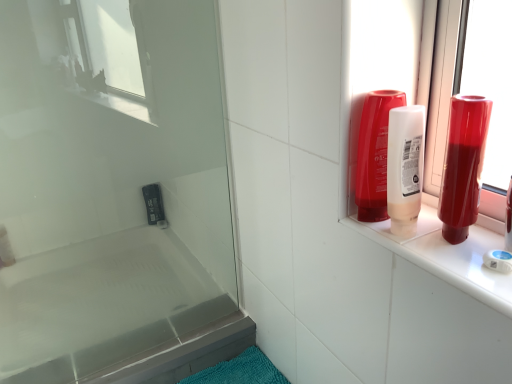
Question: From a real-world perspective, does shiny red bottle at right, which ranks as the second mouthwash in left-to-right order, sit lower than transparent glass screen door at upper left?

Choices:
 (A) no
 (B) yes

Answer: (A)

Question: Is shiny red bottle at right, which ranks as the second mouthwash in left-to-right order, positioned with its back to transparent glass screen door at upper left?

Choices:
 (A) no
 (B) yes

Answer: (A)

Question: Is shiny red bottle at right, which ranks as the second mouthwash in left-to-right order, shorter than transparent glass screen door at upper left?

Choices:
 (A) yes
 (B) no

Answer: (A)

Question: Is shiny red bottle at right, the first mouthwash viewed from the right, bigger than transparent glass screen door at upper left?

Choices:
 (A) yes
 (B) no

Answer: (B)

Question: Is shiny red bottle at right, the first mouthwash viewed from the right, not within transparent glass screen door at upper left?

Choices:
 (A) yes
 (B) no

Answer: (A)

Question: In terms of width, does transparent glass screen door at upper left look wider or thinner when compared to translucent plastic soap at lower left?

Choices:
 (A) thin
 (B) wide

Answer: (A)

Question: Which is correct: transparent glass screen door at upper left is inside translucent plastic soap at lower left, or outside of it?

Choices:
 (A) inside
 (B) outside

Answer: (B)

Question: Relative to translucent plastic soap at lower left, is transparent glass screen door at upper left in front or behind?

Choices:
 (A) front
 (B) behind

Answer: (A)

Question: Is point (49, 210) positioned closer to the camera than point (3, 253)?

Choices:
 (A) farther
 (B) closer

Answer: (A)

Question: Which is correct: translucent plastic mouthwash at upper right, which appears as the second mouthwash when viewed from the right, is inside white glossy bathtub at lower left, or outside of it?

Choices:
 (A) outside
 (B) inside

Answer: (A)

Question: Considering the positions of translucent plastic mouthwash at upper right, the 1th mouthwash when ordered from left to right, and white glossy bathtub at lower left in the image, is translucent plastic mouthwash at upper right, the 1th mouthwash when ordered from left to right, wider or thinner than white glossy bathtub at lower left?

Choices:
 (A) thin
 (B) wide

Answer: (A)

Question: Is translucent plastic mouthwash at upper right, which appears as the second mouthwash when viewed from the right, taller or shorter than white glossy bathtub at lower left?

Choices:
 (A) short
 (B) tall

Answer: (B)

Question: Based on their positions, is translucent plastic mouthwash at upper right, which appears as the second mouthwash when viewed from the right, located to the left or right of white glossy bathtub at lower left?

Choices:
 (A) left
 (B) right

Answer: (B)

Question: Is translucent plastic mouthwash at upper right, the 1th mouthwash when ordered from left to right, wider or thinner than translucent plastic soap at lower left?

Choices:
 (A) thin
 (B) wide

Answer: (B)

Question: Considering the positions of translucent plastic mouthwash at upper right, which appears as the second mouthwash when viewed from the right, and translucent plastic soap at lower left in the image, is translucent plastic mouthwash at upper right, which appears as the second mouthwash when viewed from the right, bigger or smaller than translucent plastic soap at lower left?

Choices:
 (A) small
 (B) big

Answer: (B)